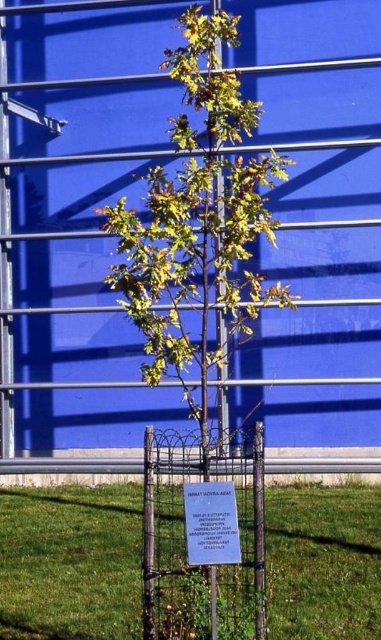
You are standing in front of the young tree and want to walk towards the blue matte garage door at center. Which direction should you walk relative to the green grass at lower center?

The blue matte garage door at center is located to the left of the green grass at lower center, so you should walk to the left relative to the green grass at lower center to reach it.

You are a gardener who needs to water the green leafy tree at center and the white paper sign at center. Your watering can has a range of 4 feet. Can you water both objects without moving the watering can?

The green leafy tree at center and the white paper sign at center are 4.16 feet apart from each other. Since the watering can has a range of 4 feet, which is less than the distance between them, you cannot water both objects without moving the watering can.